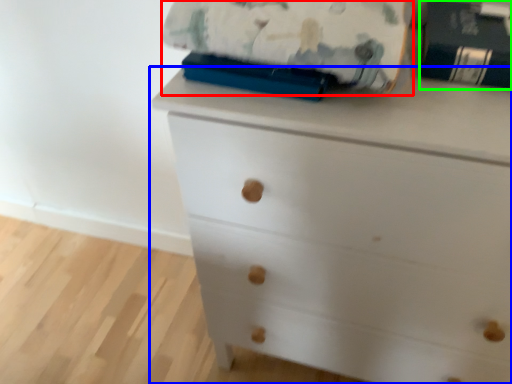
Question: Estimate the real-world distances between objects in this image. Which object is closer to blanket (highlighted by a red box), chest of drawers (highlighted by a blue box) or paperback book (highlighted by a green box)?

Choices:
 (A) chest of drawers
 (B) paperback book

Answer: (B)